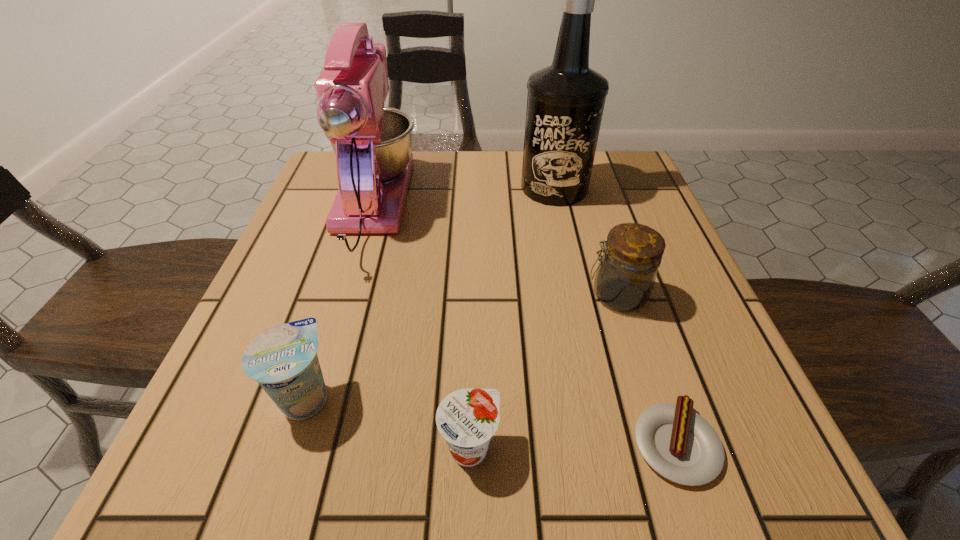
The height and width of the screenshot is (540, 960). Find the location of `vacant region at the near left corner of the desktop`. vacant region at the near left corner of the desktop is located at coordinates (234, 449).

The image size is (960, 540). What are the coordinates of `free space at the far right corner of the desktop` in the screenshot? It's located at (596, 166).

Identify the location of unoccupied area between the liquor and the left yogurt. (430, 292).

Identify the location of empty location between the second tallest object and the tallest object. The image size is (960, 540). (463, 200).

This screenshot has height=540, width=960. Identify the location of free space between the fifth shortest object and the right yogurt. (420, 330).

You are a GUI agent. You are given a task and a screenshot of the screen. Output one action in this format:
    pyautogui.click(x=<x>, y=<y>)
    Task: Click on the vacant region between the tallest object and the fourth tallest object
    Image resolution: width=960 pixels, height=540 pixels.
    Given the screenshot: What is the action you would take?
    pyautogui.click(x=430, y=292)

You are a GUI agent. You are given a task and a screenshot of the screen. Output one action in this format:
    pyautogui.click(x=<x>, y=<y>)
    Task: Click on the vacant space in between the shortest object and the right yogurt
    
    Given the screenshot: What is the action you would take?
    pyautogui.click(x=572, y=446)

Locate an element on the screen. Image resolution: width=960 pixels, height=540 pixels. free spot between the liquor and the taller yogurt is located at coordinates (430, 292).

Identify the location of empty space that is in between the jar and the left yogurt. Image resolution: width=960 pixels, height=540 pixels. (461, 346).

What are the coordinates of `free space between the jar and the right yogurt` in the screenshot? It's located at (543, 372).